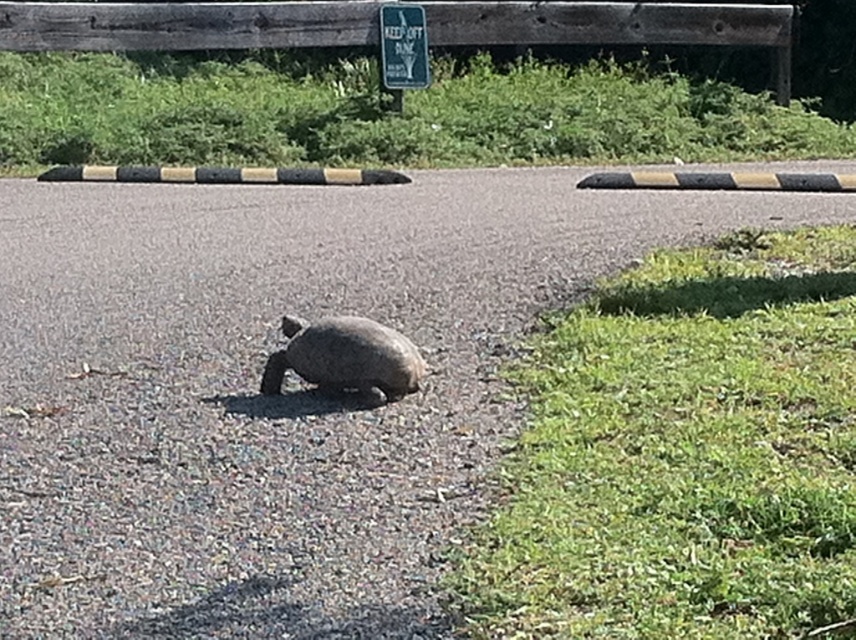
Who is taller, brown matte tortoise at center or green plastic sign at upper center?

green plastic sign at upper center is taller.

In the scene shown: Is brown matte tortoise at center smaller than green plastic sign at upper center?

Yes, brown matte tortoise at center is smaller than green plastic sign at upper center.

The width and height of the screenshot is (856, 640). What do you see at coordinates (345, 356) in the screenshot?
I see `brown matte tortoise at center` at bounding box center [345, 356].

Find the location of a particular element. This screenshot has height=640, width=856. brown matte tortoise at center is located at coordinates (345, 356).